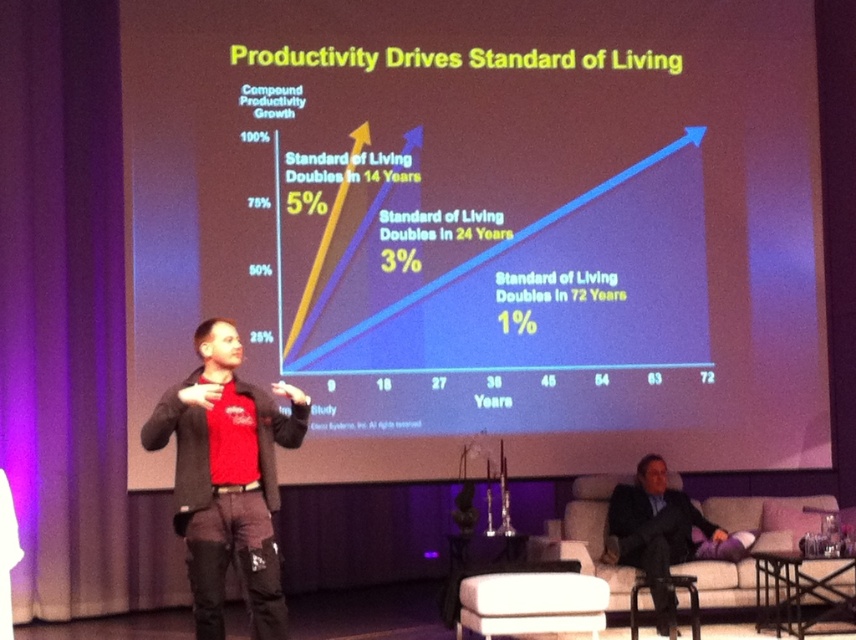
Is red cotton shirt at center thinner than black suit at lower right?

Yes.

Does red cotton shirt at center appear on the right side of black suit at lower right?

In fact, red cotton shirt at center is to the left of black suit at lower right.

Which is in front, point (257, 554) or point (702, 531)?

Positioned in front is point (257, 554).

Locate an element on the screen. Image resolution: width=856 pixels, height=640 pixels. red cotton shirt at center is located at coordinates (227, 477).

What do you see at coordinates (485, 225) in the screenshot? I see `white matte projection screen at upper center` at bounding box center [485, 225].

Can you confirm if white matte projection screen at upper center is positioned to the left of black suit at lower right?

Correct, you'll find white matte projection screen at upper center to the left of black suit at lower right.

Does point (147, 314) lie in front of point (687, 512)?

No, it is not.

You are a GUI agent. You are given a task and a screenshot of the screen. Output one action in this format:
    pyautogui.click(x=<x>, y=<y>)
    Task: Click on the white matte projection screen at upper center
    Image resolution: width=856 pixels, height=640 pixels.
    Given the screenshot: What is the action you would take?
    pyautogui.click(x=485, y=225)

Is white matte projection screen at upper center wider than red cotton shirt at center?

Indeed, white matte projection screen at upper center has a greater width compared to red cotton shirt at center.

Between point (468, 225) and point (236, 426), which one is positioned in front?

Point (236, 426) is in front.

Find the location of a particular element. The height and width of the screenshot is (640, 856). white matte projection screen at upper center is located at coordinates (485, 225).